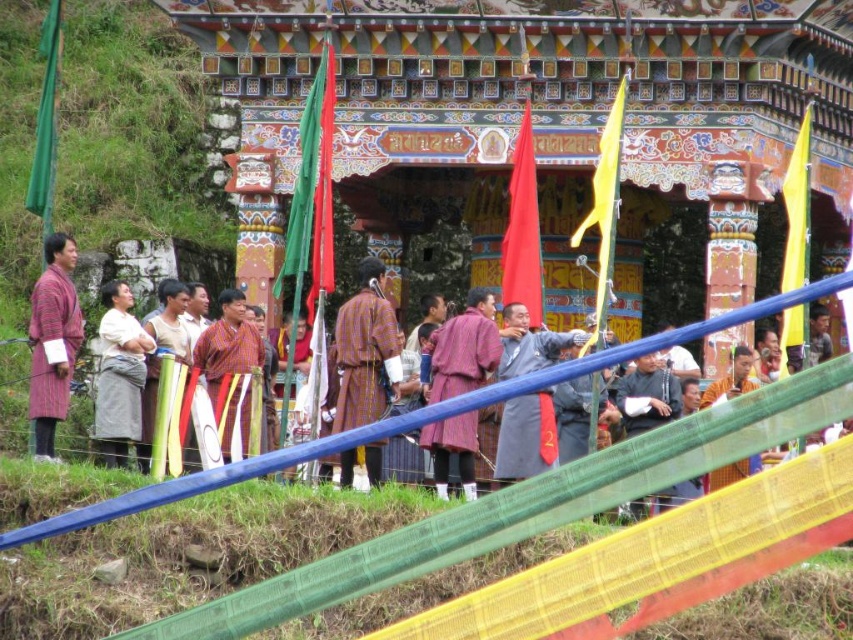
Question: Which point is closer to the camera taking this photo?

Choices:
 (A) (372, 312)
 (B) (227, 312)
 (C) (479, 314)
 (D) (64, 259)

Answer: (A)

Question: Estimate the real-world distances between objects in this image. Which object is closer to the yellow-orange fabric robe at center?

Choices:
 (A) matte purple robe at center
 (B) matte gray robe at center
 (C) orange fabric at lower right
 (D) matte brown robe at center

Answer: (A)

Question: Does matte purple robe at center appear on the right side of orange fabric at lower right?

Choices:
 (A) yes
 (B) no

Answer: (B)

Question: Which object is positioned farthest from the matte brown robe at center?

Choices:
 (A) orange fabric at lower right
 (B) matte purple robe at center
 (C) yellow-orange fabric robe at center

Answer: (A)

Question: Does yellow-orange fabric robe at center have a smaller size compared to orange fabric at lower right?

Choices:
 (A) yes
 (B) no

Answer: (B)

Question: Can you confirm if matte purple robe at left is bigger than orange fabric at lower right?

Choices:
 (A) yes
 (B) no

Answer: (A)